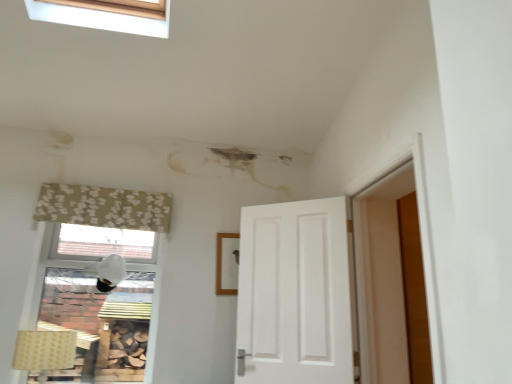
Find the location of `yellow fabric lampshade at lower left, which is the 1th lamp in bottom-to-top order`. yellow fabric lampshade at lower left, which is the 1th lamp in bottom-to-top order is located at coordinates (44, 351).

Describe the element at coordinates (108, 272) in the screenshot. The width and height of the screenshot is (512, 384). I see `white matte lampshade at upper left, which is the second lamp from front to back` at that location.

Find the location of a particular element. This screenshot has height=384, width=512. yellow fabric lampshade at lower left, which is counted as the first lamp, starting from the left is located at coordinates (44, 351).

Which is more to the left, white matte lampshade at upper left, the first lamp in the top-to-bottom sequence, or beige floral fabric curtain at upper left?

From the viewer's perspective, beige floral fabric curtain at upper left appears more on the left side.

Is white matte lampshade at upper left, the first lamp in the top-to-bottom sequence, not close to beige floral fabric curtain at upper left?

No, white matte lampshade at upper left, the first lamp in the top-to-bottom sequence, is not far away from beige floral fabric curtain at upper left.

Is white matte lampshade at upper left, the first lamp when ordered from right to left, facing away from beige floral fabric curtain at upper left?

white matte lampshade at upper left, the first lamp when ordered from right to left, is not turned away from beige floral fabric curtain at upper left.

Between white matte lampshade at upper left, which is the second lamp from front to back, and beige floral fabric curtain at upper left, which one has more height?

white matte lampshade at upper left, which is the second lamp from front to back, is taller.

From the image's perspective, is white matte lampshade at upper left, the first lamp when ordered from right to left, positioned above or below yellow fabric lampshade at lower left, which is counted as the 1th lamp, starting from the front?

white matte lampshade at upper left, the first lamp when ordered from right to left, is above yellow fabric lampshade at lower left, which is counted as the 1th lamp, starting from the front.

Visually, is white matte lampshade at upper left, the first lamp when ordered from right to left, positioned to the left or to the right of yellow fabric lampshade at lower left, which is counted as the first lamp, starting from the left?

white matte lampshade at upper left, the first lamp when ordered from right to left, is positioned on yellow fabric lampshade at lower left, which is counted as the first lamp, starting from the left,'s right side.

Which point is more distant from viewer, (124, 199) or (75, 340)?

The point (124, 199) is farther from the camera.

Considering the relative sizes of beige floral fabric curtain at upper left and yellow fabric lampshade at lower left, marked as the 2th lamp in a right-to-left arrangement, in the image provided, is beige floral fabric curtain at upper left smaller than yellow fabric lampshade at lower left, marked as the 2th lamp in a right-to-left arrangement,?

Yes, beige floral fabric curtain at upper left is smaller than yellow fabric lampshade at lower left, marked as the 2th lamp in a right-to-left arrangement.

Is beige floral fabric curtain at upper left oriented away from yellow fabric lampshade at lower left, which ranks as the 2th lamp in top-to-bottom order?

No, beige floral fabric curtain at upper left's orientation is not away from yellow fabric lampshade at lower left, which ranks as the 2th lamp in top-to-bottom order.

Is beige floral fabric curtain at upper left wider than yellow fabric lampshade at lower left, which ranks as the 2th lamp in top-to-bottom order?

No.

From a real-world perspective, is yellow fabric lampshade at lower left, which is counted as the 1th lamp, starting from the front, over beige floral fabric curtain at upper left?

No, from a real-world perspective, yellow fabric lampshade at lower left, which is counted as the 1th lamp, starting from the front, is not on top of beige floral fabric curtain at upper left.

Can you confirm if yellow fabric lampshade at lower left, which is the 1th lamp in bottom-to-top order, is positioned to the right of beige floral fabric curtain at upper left?

Incorrect, yellow fabric lampshade at lower left, which is the 1th lamp in bottom-to-top order, is not on the right side of beige floral fabric curtain at upper left.

Does yellow fabric lampshade at lower left, marked as the 2th lamp in a right-to-left arrangement, turn towards beige floral fabric curtain at upper left?

No, yellow fabric lampshade at lower left, marked as the 2th lamp in a right-to-left arrangement, does not turn towards beige floral fabric curtain at upper left.

How far apart are yellow fabric lampshade at lower left, marked as the 2th lamp in a right-to-left arrangement, and white matte lampshade at upper left, which is the second lamp from front to back?

yellow fabric lampshade at lower left, marked as the 2th lamp in a right-to-left arrangement, is 22.53 inches from white matte lampshade at upper left, which is the second lamp from front to back.

Is yellow fabric lampshade at lower left, which is counted as the first lamp, starting from the left, positioned far away from white matte lampshade at upper left, which is the second lamp from front to back?

No, there isn't a large distance between yellow fabric lampshade at lower left, which is counted as the first lamp, starting from the left, and white matte lampshade at upper left, which is the second lamp from front to back.

Could you tell me if yellow fabric lampshade at lower left, which ranks as the 2th lamp in top-to-bottom order, is turned towards white matte lampshade at upper left, the 2th lamp from the bottom?

No, yellow fabric lampshade at lower left, which ranks as the 2th lamp in top-to-bottom order, is not turned towards white matte lampshade at upper left, the 2th lamp from the bottom.

Consider the image. How much distance is there between beige floral fabric curtain at upper left and white matte lampshade at upper left, the first lamp when ordered from right to left?

beige floral fabric curtain at upper left and white matte lampshade at upper left, the first lamp when ordered from right to left, are 17.30 inches apart from each other.

This screenshot has width=512, height=384. In order to click on lamp on the right side of beige floral fabric curtain at upper left in this screenshot , I will do `click(108, 272)`.

Is point (136, 211) positioned in front of point (110, 272)?

Yes, it is.

From the image's perspective, starting from the beige floral fabric curtain at upper left, which lamp is the 1st one below? Please provide its 2D coordinates.

[(108, 272)]

Find the location of `lamp above the yellow fabric lampshade at lower left, marked as the 2th lamp in a right-to-left arrangement (from a real-world perspective)`. lamp above the yellow fabric lampshade at lower left, marked as the 2th lamp in a right-to-left arrangement (from a real-world perspective) is located at coordinates (108, 272).

From the image, which object appears to be farther from beige floral fabric curtain at upper left, white matte lampshade at upper left, which is the first lamp from back to front, or yellow fabric lampshade at lower left, marked as the 2th lamp in a back-to-front arrangement?

yellow fabric lampshade at lower left, marked as the 2th lamp in a back-to-front arrangement.

When comparing their distances from white matte lampshade at upper left, the first lamp when ordered from right to left, does yellow fabric lampshade at lower left, which ranks as the 2th lamp in top-to-bottom order, or beige floral fabric curtain at upper left seem further?

yellow fabric lampshade at lower left, which ranks as the 2th lamp in top-to-bottom order, lies further to white matte lampshade at upper left, the first lamp when ordered from right to left, than the other object.

Looking at the image, which one is located closer to white matte lampshade at upper left, the first lamp when ordered from right to left, beige floral fabric curtain at upper left or yellow fabric lampshade at lower left, which ranks as the 2th lamp in top-to-bottom order?

Based on the image, beige floral fabric curtain at upper left appears to be nearer to white matte lampshade at upper left, the first lamp when ordered from right to left.

When comparing their distances from beige floral fabric curtain at upper left, does yellow fabric lampshade at lower left, marked as the 2th lamp in a right-to-left arrangement, or white matte lampshade at upper left, positioned as the 2th lamp in left-to-right order, seem further?

Among the two, yellow fabric lampshade at lower left, marked as the 2th lamp in a right-to-left arrangement, is located further to beige floral fabric curtain at upper left.

Based on their spatial positions, is beige floral fabric curtain at upper left or white matte lampshade at upper left, the first lamp when ordered from right to left, further from yellow fabric lampshade at lower left, which is counted as the first lamp, starting from the left?

beige floral fabric curtain at upper left is positioned further to the anchor yellow fabric lampshade at lower left, which is counted as the first lamp, starting from the left.

Consider the image. When comparing their distances from yellow fabric lampshade at lower left, which is the 1th lamp in bottom-to-top order, does white matte lampshade at upper left, which is the second lamp from front to back, or beige floral fabric curtain at upper left seem closer?

white matte lampshade at upper left, which is the second lamp from front to back, is positioned closer to the anchor yellow fabric lampshade at lower left, which is the 1th lamp in bottom-to-top order.

The width and height of the screenshot is (512, 384). What are the coordinates of `lamp that lies between beige floral fabric curtain at upper left and yellow fabric lampshade at lower left, marked as the 2th lamp in a back-to-front arrangement, from top to bottom` in the screenshot? It's located at (108, 272).